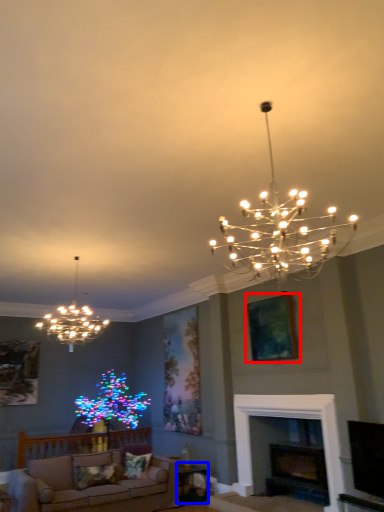
Question: Which of the following is the closest to the observer, picture frame (highlighted by a red box) or table (highlighted by a blue box)?

Choices:
 (A) picture frame
 (B) table

Answer: (A)